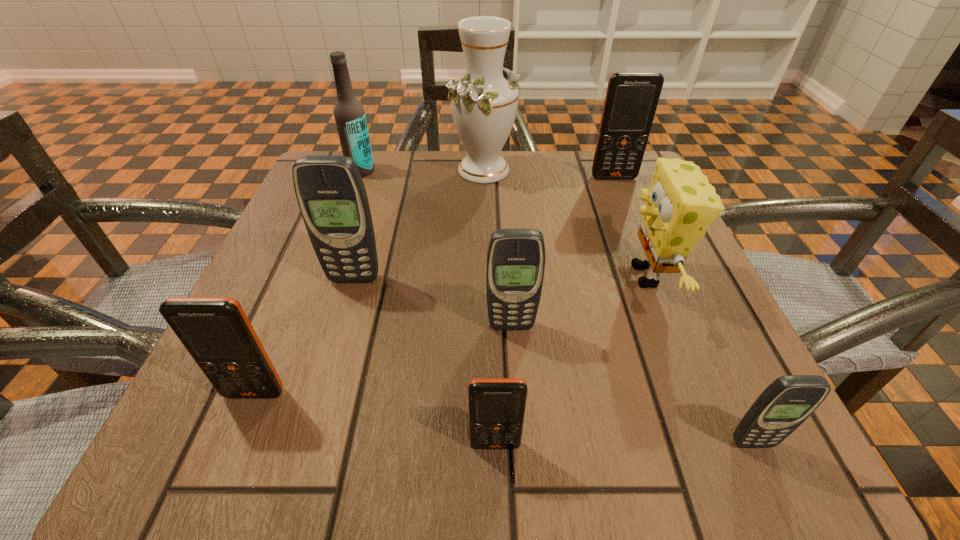
Identify which gray cellular telephone is located as the nearest to the nearest gray cellular telephone. Please provide its 2D coordinates. Your answer should be formatted as a tuple, i.e. [(x, y)], where the tuple contains the x and y coordinates of a point satisfying the conditions above.

[(516, 257)]

This screenshot has width=960, height=540. In order to click on gray cellular telephone that stands as the second closest to the fourth nearest cellular telephone in this screenshot , I will do `click(787, 402)`.

This screenshot has height=540, width=960. I want to click on vacant space that satisfies the following two spatial constraints: 1. on the face of the sponge; 2. on the screen of the fourth nearest cellular telephone, so click(666, 326).

Find the location of a particular element. free spot that satisfies the following two spatial constraints: 1. on the face of the sponge; 2. on the screen of the third farthest cellular telephone is located at coordinates coord(666,326).